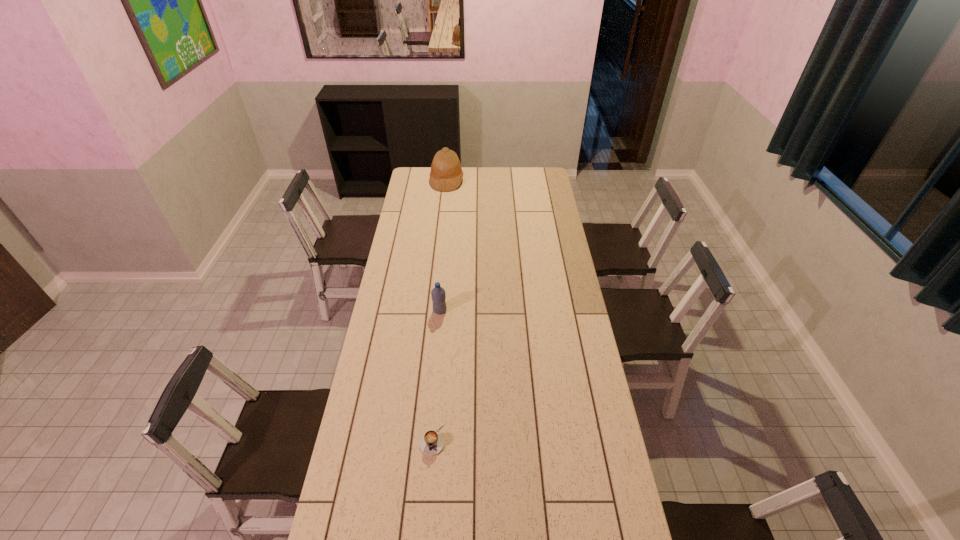
Locate an element on the screen. Image resolution: width=960 pixels, height=540 pixels. object situated at the left edge is located at coordinates [x=446, y=174].

I want to click on object at the far left corner, so click(x=446, y=174).

Find the location of a particular element. vacant point at the far edge is located at coordinates (500, 169).

The width and height of the screenshot is (960, 540). Find the location of `blank space at the left edge of the desktop`. blank space at the left edge of the desktop is located at coordinates (412, 229).

Locate an element on the screen. The height and width of the screenshot is (540, 960). free space at the right edge of the desktop is located at coordinates (558, 233).

Image resolution: width=960 pixels, height=540 pixels. Identify the location of vacant point located between the second nearest object and the farthest object. (444, 246).

Identify the location of vacant region between the farthest object and the second farthest object. The width and height of the screenshot is (960, 540). (444, 246).

Where is `blank region between the hat and the second shortest object`? Image resolution: width=960 pixels, height=540 pixels. blank region between the hat and the second shortest object is located at coordinates (444, 246).

Locate an element on the screen. This screenshot has height=540, width=960. free space between the shortest object and the second shortest object is located at coordinates (436, 375).

Locate an element on the screen. This screenshot has width=960, height=540. free space between the second shortest object and the cappuccino is located at coordinates (436, 375).